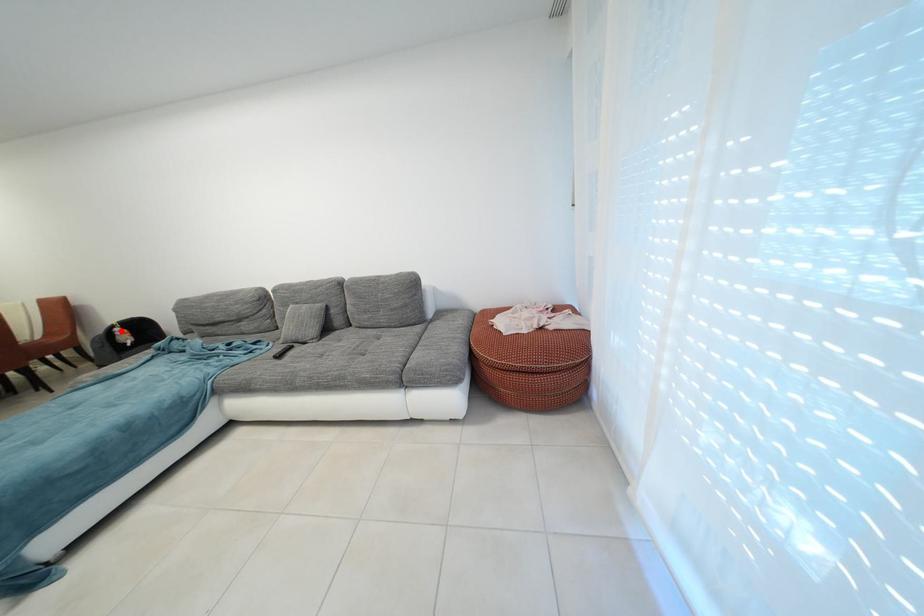
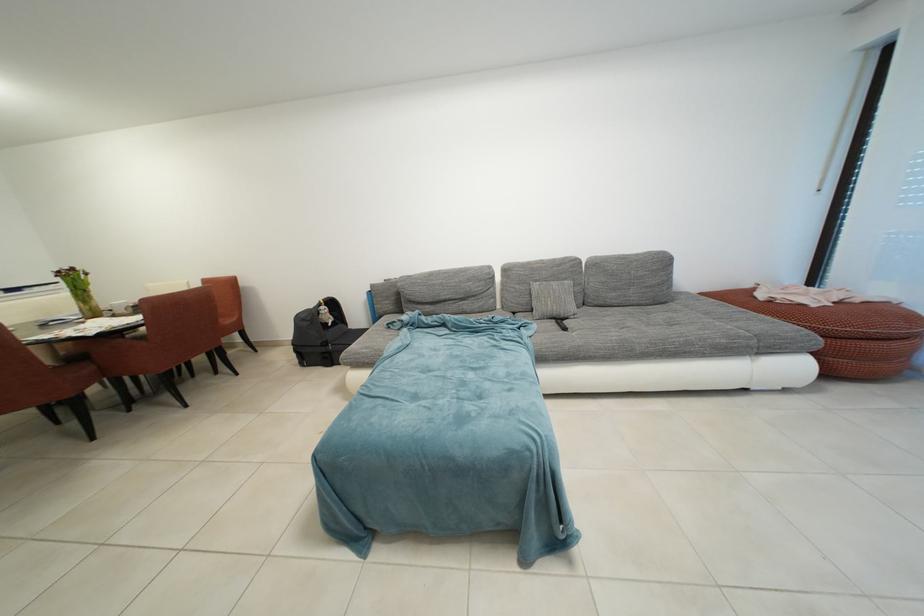
Question: I am providing you with two images of the same scene from different viewpoints. Given a red point in image1, look at the same physical point in image2. Is it:

Choices:
 (A) Closer to the viewpoint
 (B) Farther from the viewpoint

Answer: (A)